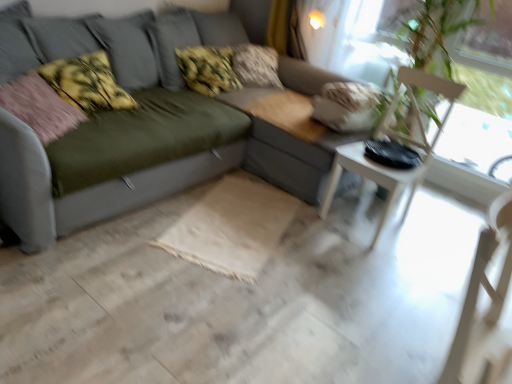
Image resolution: width=512 pixels, height=384 pixels. I want to click on free space behind white wood armchair at right, marked as the first armchair in a front-to-back arrangement, so click(x=392, y=342).